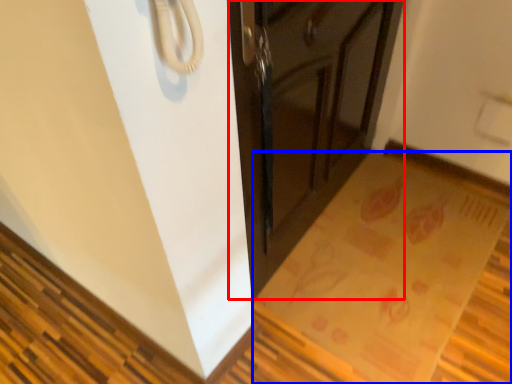
Question: Which of the following is the closest to the observer, cabinetry (highlighted by a red box) or mat (highlighted by a blue box)?

Choices:
 (A) cabinetry
 (B) mat

Answer: (A)